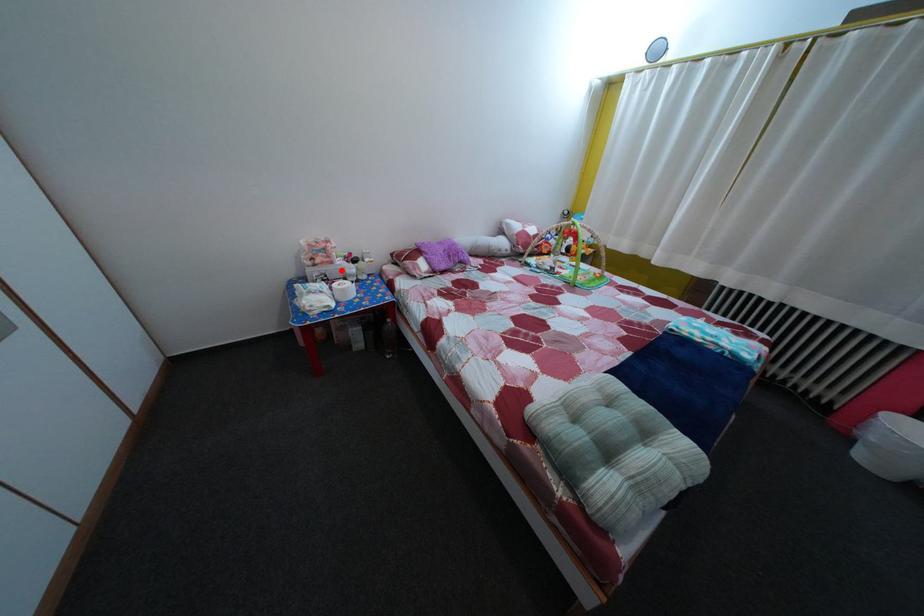
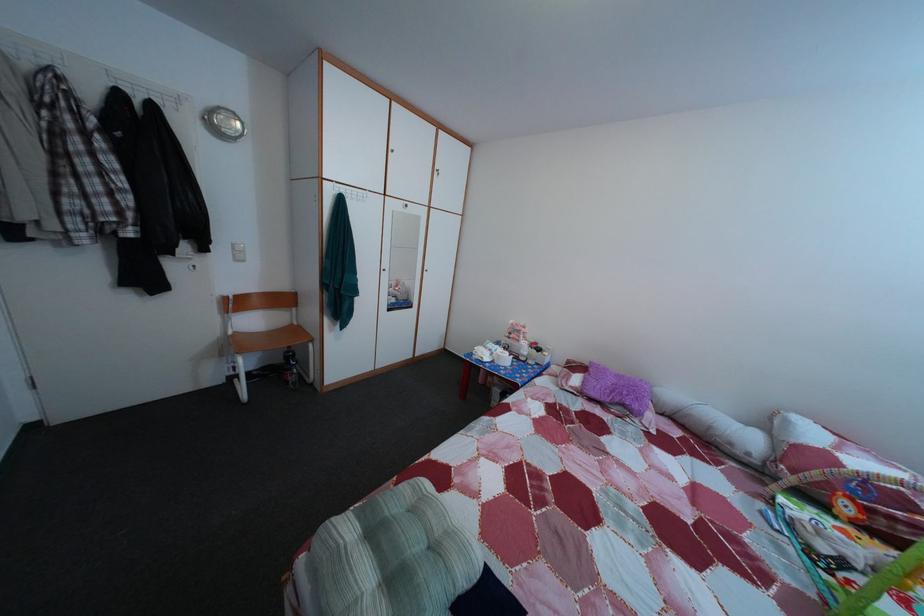
Question: I am providing you with two images of the same scene from different viewpoints. In image1, a red point is highlighted. Considering the same 3D point in image2, which of the following is correct?

Choices:
 (A) It is closer
 (B) It is farther

Answer: (B)